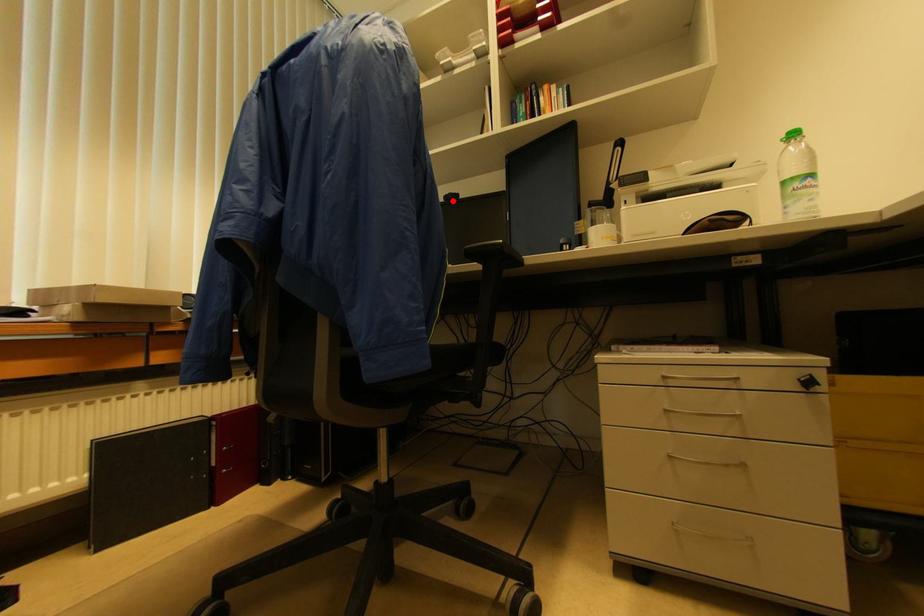
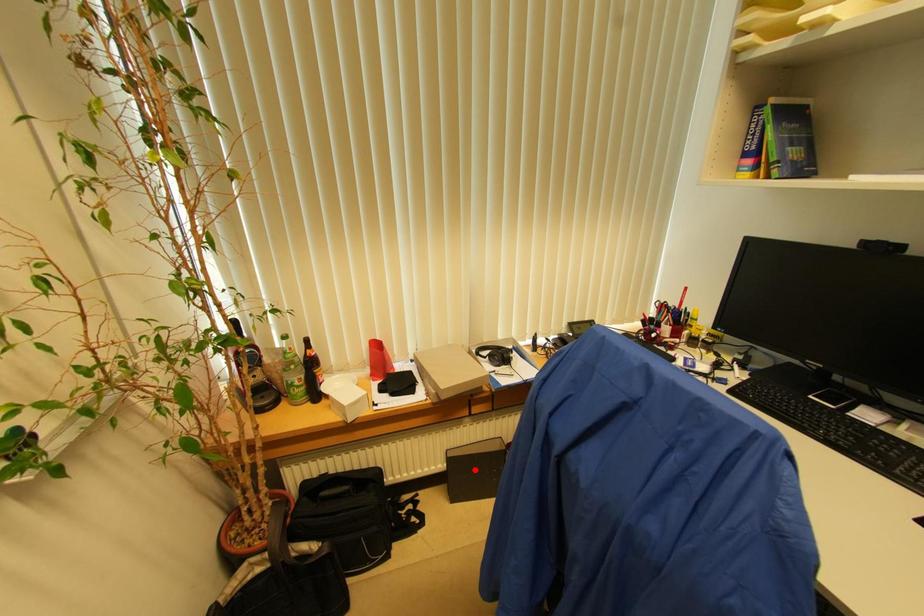
I am providing you with two images of the same scene from different viewpoints. A red point is marked on the first image and another point is marked on the second image. Is the marked point in image1 the same physical position as the marked point in image2?

No